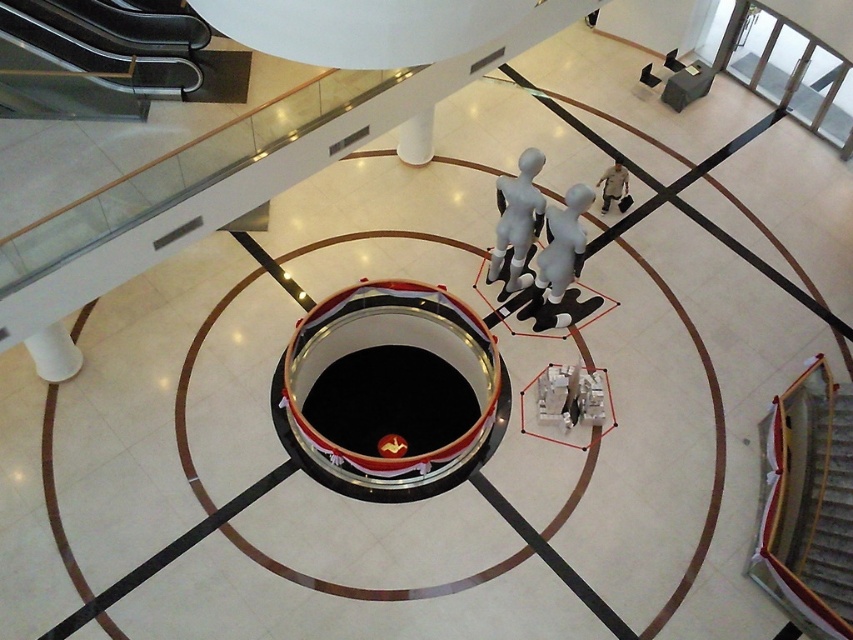
Question: Which point is closer to the camera?

Choices:
 (A) (523, 164)
 (B) (798, 516)

Answer: (B)

Question: Among these points, which one is nearest to the camera?

Choices:
 (A) (625, 189)
 (B) (811, 484)
 (C) (546, 298)

Answer: (B)

Question: Which object is closer to the camera taking this photo?

Choices:
 (A) brown fabric shirt at upper right
 (B) wooden staircase at lower right

Answer: (B)

Question: Does wooden staircase at lower right have a larger size compared to smooth matte mannequin at center?

Choices:
 (A) yes
 (B) no

Answer: (A)

Question: Is white matte mannequin at center to the right of brown fabric shirt at upper right from the viewer's perspective?

Choices:
 (A) no
 (B) yes

Answer: (A)

Question: Does wooden staircase at lower right appear on the left side of smooth matte mannequin at center?

Choices:
 (A) no
 (B) yes

Answer: (A)